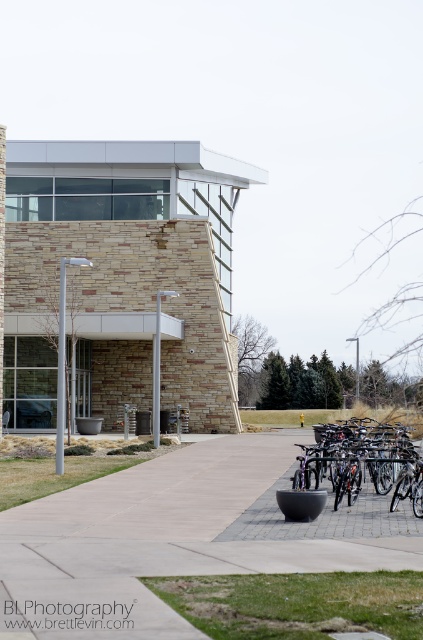
Does gray concrete pavement at center appear under shiny metallic bicycles at lower right?

Indeed, gray concrete pavement at center is positioned under shiny metallic bicycles at lower right.

Find the location of a particular element. The image size is (423, 640). gray concrete pavement at center is located at coordinates (172, 540).

Is point (104, 497) closer to viewer compared to point (381, 442)?

Yes, point (104, 497) is in front of point (381, 442).

Where is `gray concrete pavement at center`? This screenshot has width=423, height=640. gray concrete pavement at center is located at coordinates (172, 540).